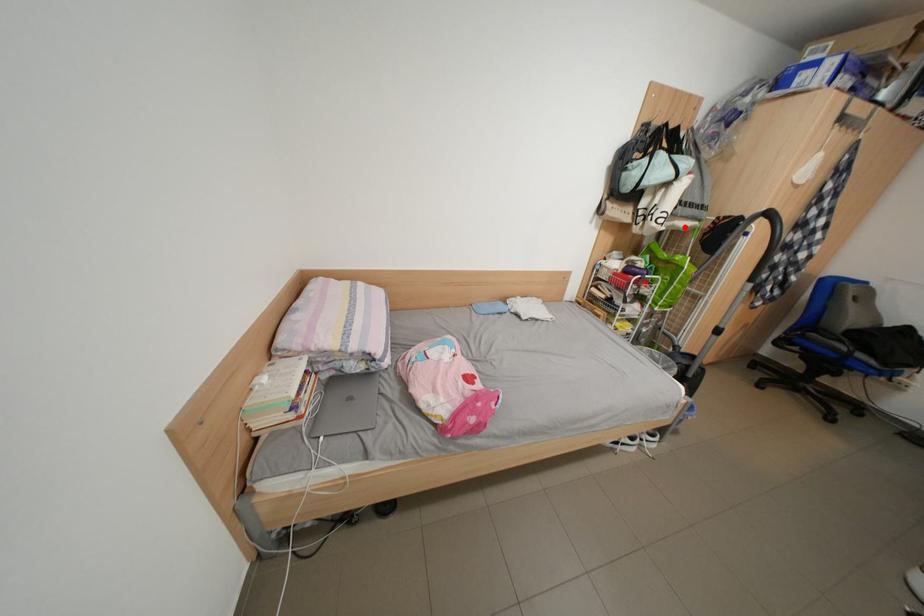
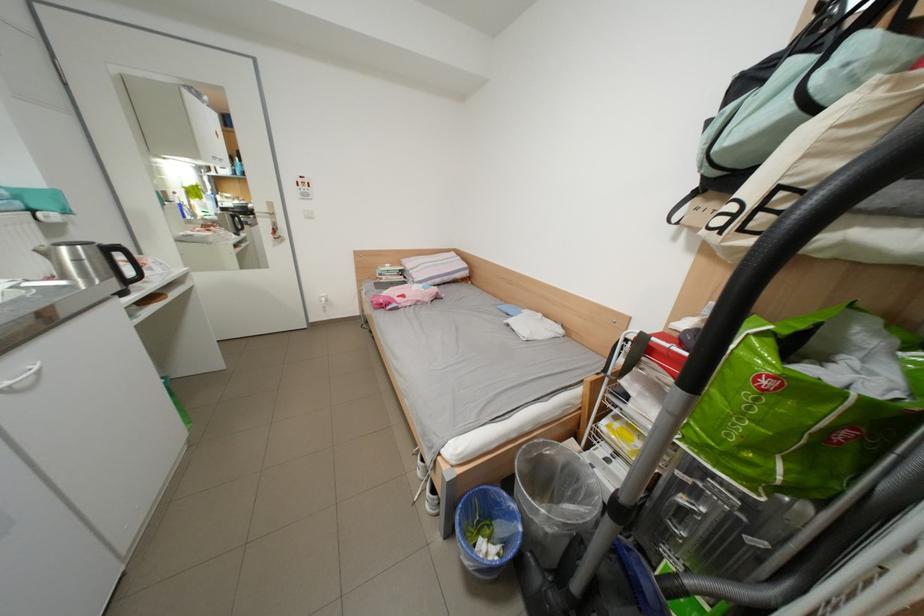
Question: I am providing you with two images of the same scene from different viewpoints. Given a red point in image1, look at the same physical point in image2. Is it:

Choices:
 (A) Closer to the viewpoint
 (B) Farther from the viewpoint

Answer: (B)